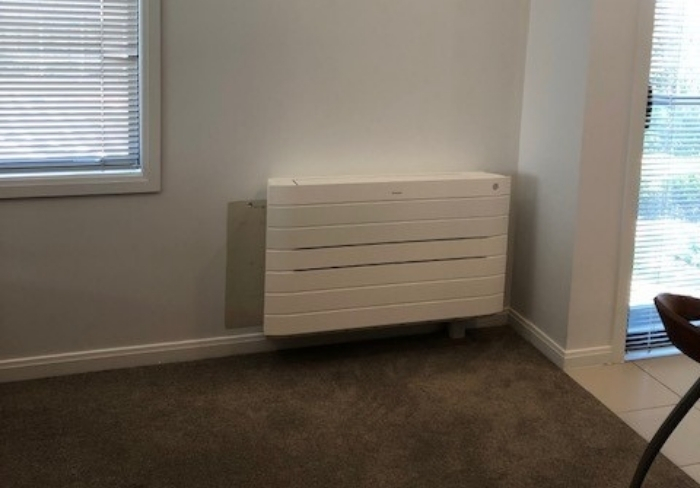
This screenshot has height=488, width=700. I want to click on divder/part/whatever you call the partial wall separating rooms, so click(x=593, y=220).